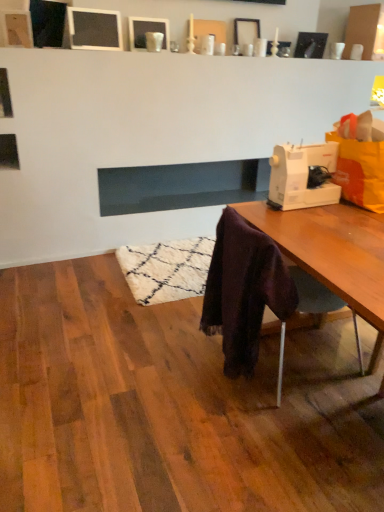
Image resolution: width=384 pixels, height=512 pixels. What do you see at coordinates (180, 186) in the screenshot?
I see `dark glass fireplace at center` at bounding box center [180, 186].

Image resolution: width=384 pixels, height=512 pixels. What do you see at coordinates (301, 176) in the screenshot?
I see `white plastic sewing machine at right` at bounding box center [301, 176].

Where is `matte white picture frame at upper center, positioned as the third picture frame in left-to-right order`? Image resolution: width=384 pixels, height=512 pixels. matte white picture frame at upper center, positioned as the third picture frame in left-to-right order is located at coordinates (246, 31).

Identify the location of velvet purple scarf at lower right. (254, 293).

The height and width of the screenshot is (512, 384). I want to click on matte black picture frame at upper center, which appears as the 4th picture frame when viewed from the right, so click(x=94, y=29).

The image size is (384, 512). In order to click on dark glass fireplace at center in this screenshot , I will do `click(180, 186)`.

From the image's perspective, is matte black picture frame at upper center, acting as the 1th picture frame starting from the left, positioned above or below white plastic sewing machine at right?

Clearly, from the image's perspective, matte black picture frame at upper center, acting as the 1th picture frame starting from the left, is above white plastic sewing machine at right.

What's the angular difference between matte black picture frame at upper center, acting as the 1th picture frame starting from the left, and white plastic sewing machine at right's facing directions?

matte black picture frame at upper center, acting as the 1th picture frame starting from the left, and white plastic sewing machine at right are facing 180 degrees away from each other.

Between point (99, 41) and point (312, 190), which one is positioned behind?

Point (99, 41)

Identify the location of chair below the white plastic sewing machine at right (from the image's perspective). (254, 293).

Which of these two, white plastic sewing machine at right or velvet purple scarf at lower right, is smaller?

white plastic sewing machine at right is smaller.

Is white plastic sewing machine at right far away from velvet purple scarf at lower right?

white plastic sewing machine at right is actually quite close to velvet purple scarf at lower right.

Is point (126, 200) farther from viewer compared to point (68, 17)?

Yes, point (126, 200) is farther from viewer.

Where is `picture frame that is the 1st one when counting upward from the dark glass fireplace at center (from the image's perspective)`? picture frame that is the 1st one when counting upward from the dark glass fireplace at center (from the image's perspective) is located at coordinates (94, 29).

Between dark glass fireplace at center and matte black picture frame at upper center, acting as the 1th picture frame starting from the left, which one is positioned behind?

dark glass fireplace at center is more distant.

Consider the image. Looking at their sizes, would you say dark glass fireplace at center is wider or thinner than matte black picture frame at upper center, which appears as the 4th picture frame when viewed from the right?

Considering their sizes, dark glass fireplace at center looks broader than matte black picture frame at upper center, which appears as the 4th picture frame when viewed from the right.

Which object is further away from the camera taking this photo, matte white picture frame at upper center, which appears as the second picture frame when viewed from the right, or matte black picture frame at upper right, marked as the 4th picture frame in a left-to-right arrangement?

matte black picture frame at upper right, marked as the 4th picture frame in a left-to-right arrangement, is further from the camera.

From the picture: From a real-world perspective, is matte white picture frame at upper center, which appears as the second picture frame when viewed from the right, positioned above or below matte black picture frame at upper right, which is the 1th picture frame from right to left?

In terms of real-world spatial position, matte white picture frame at upper center, which appears as the second picture frame when viewed from the right, is above matte black picture frame at upper right, which is the 1th picture frame from right to left.

Does matte white picture frame at upper center, which appears as the second picture frame when viewed from the right, turn towards matte black picture frame at upper right, which is the 1th picture frame from right to left?

No, matte white picture frame at upper center, which appears as the second picture frame when viewed from the right, is not turned towards matte black picture frame at upper right, which is the 1th picture frame from right to left.

From the picture: From the image's perspective, is matte white picture frame at upper center, which appears as the second picture frame when viewed from the right, below matte black picture frame at upper right, marked as the 4th picture frame in a left-to-right arrangement?

No, from the image's perspective, matte white picture frame at upper center, which appears as the second picture frame when viewed from the right, is not beneath matte black picture frame at upper right, marked as the 4th picture frame in a left-to-right arrangement.

Consider the image. From a real-world perspective, is white plastic sewing machine at right on dark glass fireplace at center?

Yes, from a real-world perspective, white plastic sewing machine at right is above dark glass fireplace at center.

Considering the sizes of white plastic sewing machine at right and dark glass fireplace at center in the image, is white plastic sewing machine at right taller or shorter than dark glass fireplace at center?

white plastic sewing machine at right is shorter than dark glass fireplace at center.

Which is nearer, [314,201] or [109,180]?

The point [314,201] is more forward.

In terms of size, does white plastic sewing machine at right appear bigger or smaller than dark glass fireplace at center?

In the image, white plastic sewing machine at right appears to be smaller than dark glass fireplace at center.

From a real-world perspective, is matte white picture frame at upper center, positioned as the third picture frame in left-to-right order, located beneath matte black picture frame at upper center, which appears as the 4th picture frame when viewed from the right?

Indeed, from a real-world perspective, matte white picture frame at upper center, positioned as the third picture frame in left-to-right order, is positioned beneath matte black picture frame at upper center, which appears as the 4th picture frame when viewed from the right.

How far apart are matte white picture frame at upper center, which appears as the second picture frame when viewed from the right, and matte black picture frame at upper center, which appears as the 4th picture frame when viewed from the right?

matte white picture frame at upper center, which appears as the second picture frame when viewed from the right, and matte black picture frame at upper center, which appears as the 4th picture frame when viewed from the right, are 1.03 meters apart.

From the matte black picture frame at upper center, which appears as the 4th picture frame when viewed from the right, count 2nd picture frame to the right and point to it. Please provide its 2D coordinates.

[(246, 31)]

Can you tell me how much matte white picture frame at upper center, positioned as the third picture frame in left-to-right order, and matte black picture frame at upper center, acting as the 1th picture frame starting from the left, differ in facing direction?

0.418 degrees separate the facing orientations of matte white picture frame at upper center, positioned as the third picture frame in left-to-right order, and matte black picture frame at upper center, acting as the 1th picture frame starting from the left.

Between matte white picture frame at upper center, which is the 3th picture frame from right to left, and dark glass fireplace at center, which one appears on the left side from the viewer's perspective?

matte white picture frame at upper center, which is the 3th picture frame from right to left.

You are a GUI agent. You are given a task and a screenshot of the screen. Output one action in this format:
    pyautogui.click(x=<x>, y=<y>)
    Task: Click on the fireplace that appears below the matte white picture frame at upper center, which is the 3th picture frame from right to left (from a real-world perspective)
    Image resolution: width=384 pixels, height=512 pixels.
    Given the screenshot: What is the action you would take?
    pyautogui.click(x=180, y=186)

Between matte white picture frame at upper center, which is the 3th picture frame from right to left, and dark glass fireplace at center, which one has smaller size?

matte white picture frame at upper center, which is the 3th picture frame from right to left, is smaller.

Which object is more forward, matte white picture frame at upper center, which is the 3th picture frame from right to left, or dark glass fireplace at center?

matte white picture frame at upper center, which is the 3th picture frame from right to left, is closer to the camera.

Where is `sewing machine in front of the matte black picture frame at upper center, acting as the 1th picture frame starting from the left`? sewing machine in front of the matte black picture frame at upper center, acting as the 1th picture frame starting from the left is located at coordinates (301, 176).

This screenshot has height=512, width=384. I want to click on chair that is below the white plastic sewing machine at right (from the image's perspective), so click(254, 293).

From the image, which object appears to be farther from matte black picture frame at upper right, marked as the 4th picture frame in a left-to-right arrangement, matte black picture frame at upper center, which appears as the 4th picture frame when viewed from the right, or matte white picture frame at upper center, which appears as the second picture frame when viewed from the left?

Based on the image, matte black picture frame at upper center, which appears as the 4th picture frame when viewed from the right, appears to be further to matte black picture frame at upper right, marked as the 4th picture frame in a left-to-right arrangement.

Considering their positions, is white plastic sewing machine at right positioned further to matte black picture frame at upper center, acting as the 1th picture frame starting from the left, than matte white picture frame at upper center, which appears as the second picture frame when viewed from the left?

white plastic sewing machine at right is positioned further to the anchor matte black picture frame at upper center, acting as the 1th picture frame starting from the left.

Looking at the image, which one is located further to white plastic sewing machine at right, matte black picture frame at upper center, acting as the 1th picture frame starting from the left, or matte white picture frame at upper center, positioned as the third picture frame in left-to-right order?

matte black picture frame at upper center, acting as the 1th picture frame starting from the left, is further to white plastic sewing machine at right.

Considering their positions, is dark glass fireplace at center positioned further to velvet purple scarf at lower right than matte black picture frame at upper right, which is the 1th picture frame from right to left?

Based on the image, matte black picture frame at upper right, which is the 1th picture frame from right to left, appears to be further to velvet purple scarf at lower right.

Considering their positions, is matte black picture frame at upper right, marked as the 4th picture frame in a left-to-right arrangement, positioned further to white plastic sewing machine at right than matte black picture frame at upper center, which appears as the 4th picture frame when viewed from the right?

matte black picture frame at upper right, marked as the 4th picture frame in a left-to-right arrangement, is positioned further to the anchor white plastic sewing machine at right.

Looking at the image, which one is located further to matte white picture frame at upper center, positioned as the third picture frame in left-to-right order, matte black picture frame at upper center, which appears as the 4th picture frame when viewed from the right, or matte black picture frame at upper right, marked as the 4th picture frame in a left-to-right arrangement?

matte black picture frame at upper center, which appears as the 4th picture frame when viewed from the right, lies further to matte white picture frame at upper center, positioned as the third picture frame in left-to-right order, than the other object.

In the scene shown: When comparing their distances from velvet purple scarf at lower right, does matte black picture frame at upper right, marked as the 4th picture frame in a left-to-right arrangement, or matte white picture frame at upper center, positioned as the third picture frame in left-to-right order, seem further?

matte black picture frame at upper right, marked as the 4th picture frame in a left-to-right arrangement, lies further to velvet purple scarf at lower right than the other object.

Considering their positions, is matte white picture frame at upper center, which appears as the second picture frame when viewed from the left, positioned further to velvet purple scarf at lower right than matte black picture frame at upper right, which is the 1th picture frame from right to left?

matte black picture frame at upper right, which is the 1th picture frame from right to left, lies further to velvet purple scarf at lower right than the other object.

At what (x,y) coordinates should I click in order to perform the action: click on fireplace between matte white picture frame at upper center, which appears as the second picture frame when viewed from the right, and white plastic sewing machine at right from top to bottom. Please return your answer as a coordinate pair (x, y). Looking at the image, I should click on (180, 186).

The image size is (384, 512). Find the location of `sewing machine between matte black picture frame at upper center, which appears as the 4th picture frame when viewed from the right, and matte black picture frame at upper right, marked as the 4th picture frame in a left-to-right arrangement`. sewing machine between matte black picture frame at upper center, which appears as the 4th picture frame when viewed from the right, and matte black picture frame at upper right, marked as the 4th picture frame in a left-to-right arrangement is located at coordinates (301, 176).

Locate an element on the screen. This screenshot has width=384, height=512. fireplace between matte black picture frame at upper right, marked as the 4th picture frame in a left-to-right arrangement, and velvet purple scarf at lower right in the up-down direction is located at coordinates (180, 186).

Locate an element on the screen. Image resolution: width=384 pixels, height=512 pixels. sewing machine that lies between matte black picture frame at upper center, acting as the 1th picture frame starting from the left, and velvet purple scarf at lower right from top to bottom is located at coordinates (301, 176).